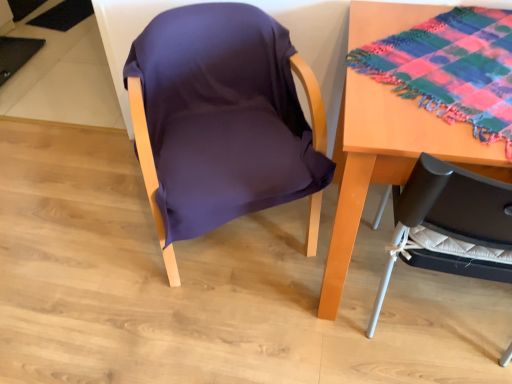
Question: Is multicolored woven cloth at upper right to the right of purple fabric chair at center from the viewer's perspective?

Choices:
 (A) yes
 (B) no

Answer: (A)

Question: Could you tell me if multicolored woven cloth at upper right is facing purple fabric chair at center?

Choices:
 (A) yes
 (B) no

Answer: (B)

Question: From a real-world perspective, is multicolored woven cloth at upper right positioned over purple fabric chair at center based on gravity?

Choices:
 (A) yes
 (B) no

Answer: (A)

Question: Can you confirm if multicolored woven cloth at upper right is bigger than purple fabric chair at center?

Choices:
 (A) no
 (B) yes

Answer: (A)

Question: From a real-world perspective, is multicolored woven cloth at upper right located beneath purple fabric chair at center?

Choices:
 (A) no
 (B) yes

Answer: (A)

Question: From the image's perspective, relative to multicolored woven cloth at upper right, is purple fabric chair at center above or below?

Choices:
 (A) above
 (B) below

Answer: (B)

Question: From a real-world perspective, is purple fabric chair at center positioned above or below multicolored woven cloth at upper right?

Choices:
 (A) below
 (B) above

Answer: (A)

Question: Would you say purple fabric chair at center is inside or outside multicolored woven cloth at upper right?

Choices:
 (A) inside
 (B) outside

Answer: (B)

Question: Is purple fabric chair at center bigger or smaller than multicolored woven cloth at upper right?

Choices:
 (A) big
 (B) small

Answer: (A)

Question: Is wooden table at right bigger or smaller than purple fabric chair at center?

Choices:
 (A) small
 (B) big

Answer: (A)

Question: Is wooden table at right in front of or behind purple fabric chair at center in the image?

Choices:
 (A) front
 (B) behind

Answer: (A)

Question: From the image's perspective, is wooden table at right above or below purple fabric chair at center?

Choices:
 (A) below
 (B) above

Answer: (A)

Question: Is point (350, 170) closer or farther from the camera than point (184, 130)?

Choices:
 (A) closer
 (B) farther

Answer: (A)

Question: From their relative heights in the image, would you say multicolored woven cloth at upper right is taller or shorter than wooden table at right?

Choices:
 (A) short
 (B) tall

Answer: (A)

Question: From the image's perspective, is multicolored woven cloth at upper right located above or below wooden table at right?

Choices:
 (A) above
 (B) below

Answer: (A)